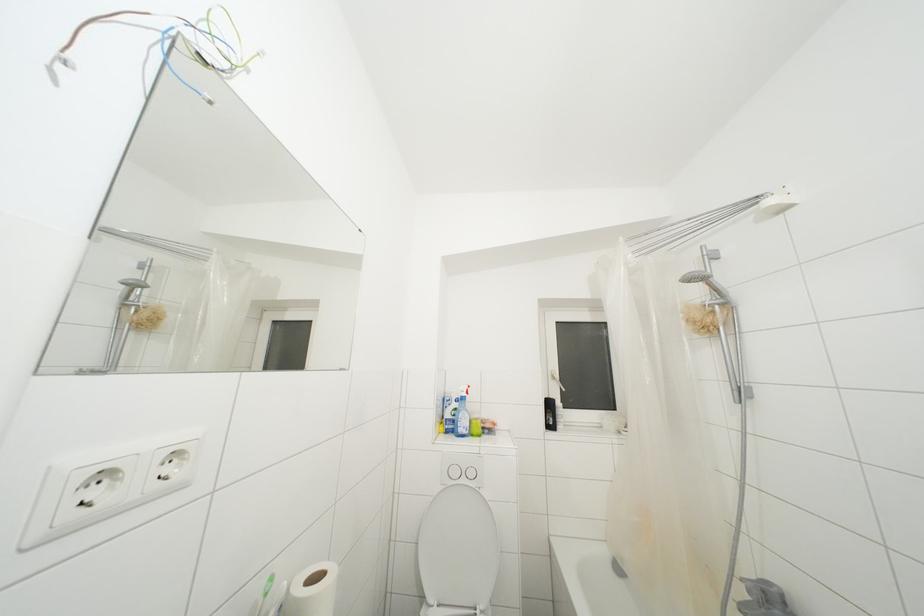
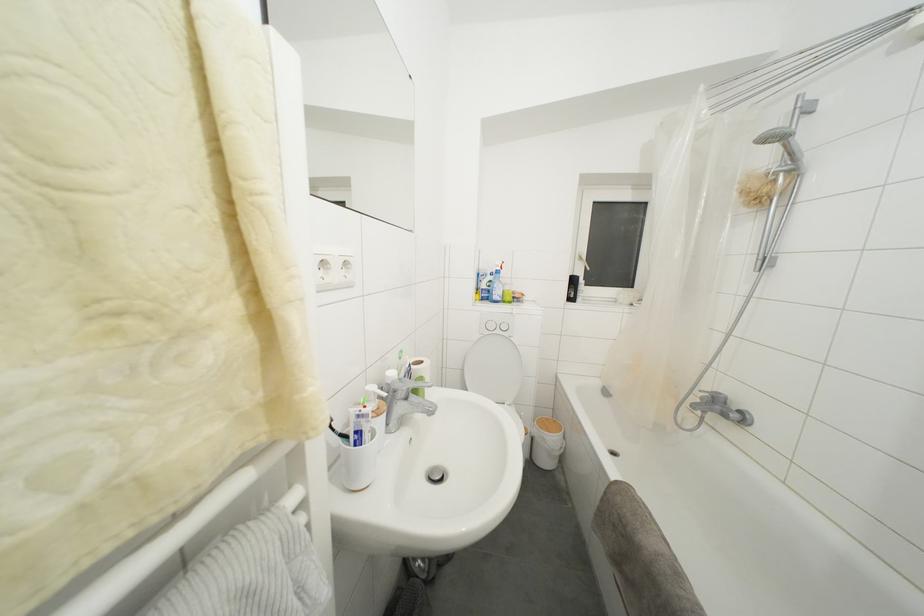
The point at (553,410) is marked in the first image. Where is the corresponding point in the second image?

(578, 286)